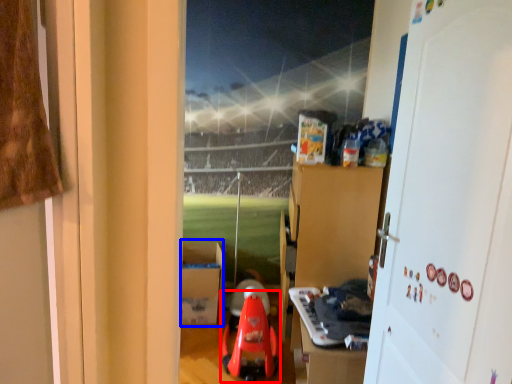
Question: Which object appears closest to the camera in this image, toy (highlighted by a red box) or cardboard box (highlighted by a blue box)?

Choices:
 (A) toy
 (B) cardboard box

Answer: (A)